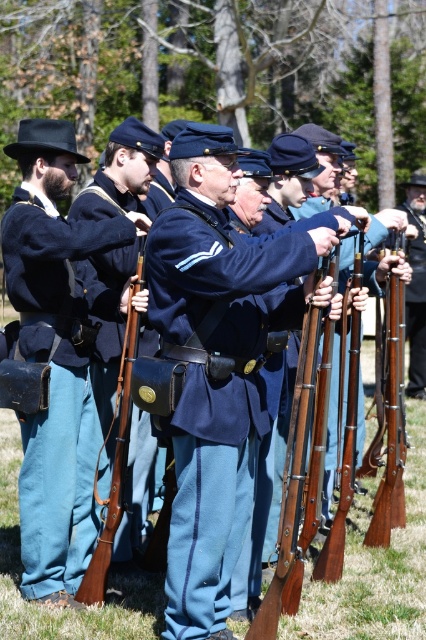
Which is above, navy blue wool uniform at center or matte black uniform at left?

matte black uniform at left is above.

Between point (164, 305) and point (77, 292), which one is positioned behind?

The point (77, 292) is more distant.

Where is `navy blue wool uniform at center`? This screenshot has width=426, height=640. navy blue wool uniform at center is located at coordinates (215, 388).

Who is higher up, matte black uniform at left or brown wooden rifle at center?

Positioned higher is matte black uniform at left.

Can you confirm if matte black uniform at left is positioned below brown wooden rifle at center?

No, matte black uniform at left is not below brown wooden rifle at center.

Identify the location of matte black uniform at left. (52, 358).

Does navy blue wool uniform at center have a greater height compared to blue fabric uniform at center?

In fact, navy blue wool uniform at center may be shorter than blue fabric uniform at center.

Is navy blue wool uniform at center to the right of blue fabric uniform at center from the viewer's perspective?

Incorrect, navy blue wool uniform at center is not on the right side of blue fabric uniform at center.

Does point (245, 388) come farther from viewer compared to point (411, 300)?

No, (245, 388) is in front of (411, 300).

The image size is (426, 640). I want to click on navy blue wool uniform at center, so click(215, 388).